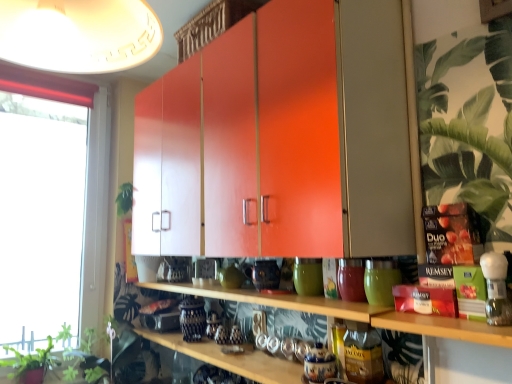
Question: In the image, is green leafy plant at lower left, which is counted as the 3th plant, starting from the right, on the left side or the right side of green matte vase at center, marked as the 3th pottery in a front-to-back arrangement?

Choices:
 (A) left
 (B) right

Answer: (A)

Question: Is green leafy plant at lower left, the 2th plant from the back, bigger or smaller than green matte vase at center, marked as the 3th pottery in a front-to-back arrangement?

Choices:
 (A) big
 (B) small

Answer: (A)

Question: Which is nearer to the green leafy plant at lower left, the second plant when ordered from front to back?

Choices:
 (A) transparent glass window at left
 (B) matte ceramic jar at center, which ranks as the second pottery in right-to-left order
 (C) green matte plant at lower left, which appears as the 2th plant when viewed from the right
 (D) wooden shelf at center, the 2th shelf ordered from the bottom
 (E) wooden shelf at center, the first shelf from the bottom

Answer: (C)

Question: Which of these objects is positioned farthest from the wooden shelf at center, the first shelf from the bottom?

Choices:
 (A) wooden shelf at center, the 2th shelf ordered from the bottom
 (B) transparent glass window at left
 (C) matte orange cabinet at center
 (D) matte white lampshade at upper left
 (E) green matte vase at center, which is counted as the first pottery, starting from the back

Answer: (B)